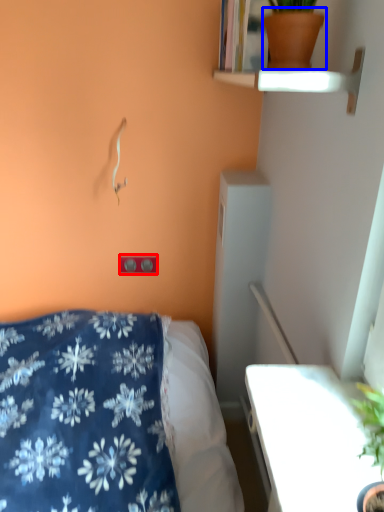
Question: Which object appears closest to the camera in this image, electric outlet (highlighted by a red box) or flowerpot (highlighted by a blue box)?

Choices:
 (A) electric outlet
 (B) flowerpot

Answer: (B)